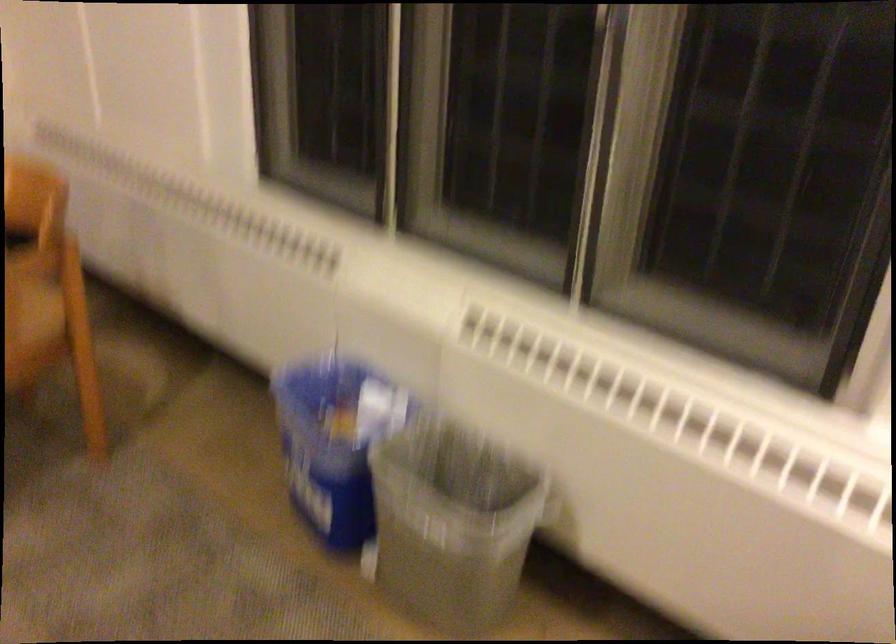
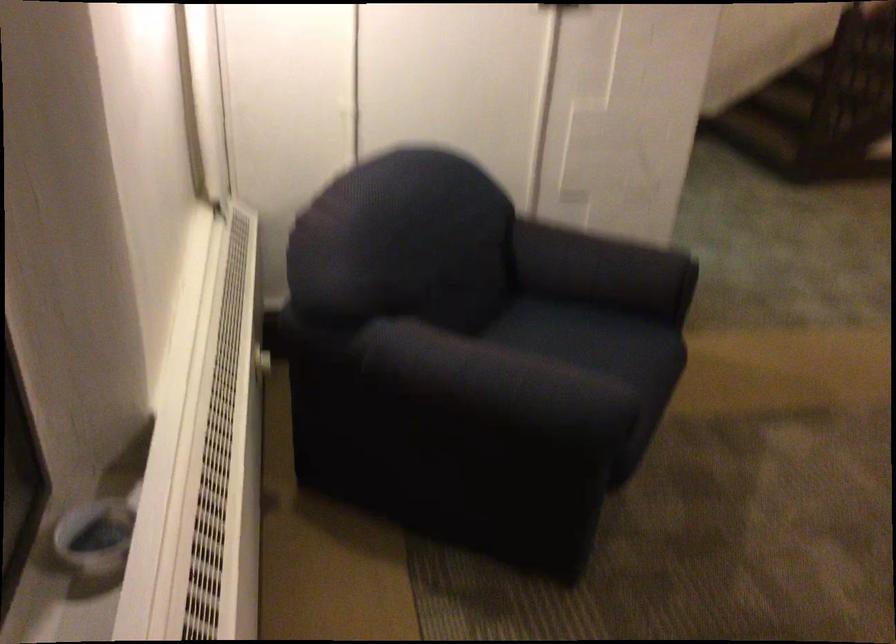
In the second image, find the point that corresponds to the point at 796,458 in the first image.

(218, 462)